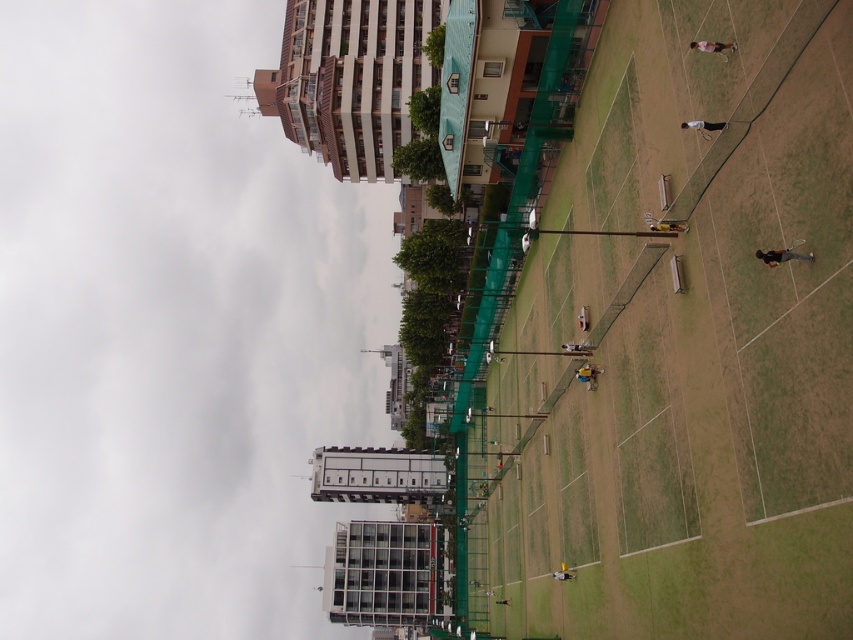
Does light brown leather jacket at upper right appear under white matte tennis racket at upper right?

Incorrect, light brown leather jacket at upper right is not positioned below white matte tennis racket at upper right.

Consider the image. Does light brown leather jacket at upper right have a lesser width compared to white matte tennis racket at upper right?

No.

Is point (733, 45) closer to viewer compared to point (712, 124)?

Yes, it is.

At what (x,y) coordinates should I click in order to perform the action: click on light brown leather jacket at upper right. Please return your answer as a coordinate pair (x, y). This screenshot has height=640, width=853. Looking at the image, I should click on (712, 48).

Between green grass at center and white matte tennis racket at upper right, which one appears on the left side from the viewer's perspective?

From the viewer's perspective, green grass at center appears more on the left side.

At what (x,y) coordinates should I click in order to perform the action: click on green grass at center. Please return your answer as a coordinate pair (x, y). Looking at the image, I should click on (683, 346).

Find the location of `yellow-green fabric tennis racket at right`. yellow-green fabric tennis racket at right is located at coordinates [x=781, y=257].

Does point (784, 250) come in front of point (689, 42)?

That is True.

Where is `yellow-green fabric tennis racket at right`? yellow-green fabric tennis racket at right is located at coordinates 781,257.